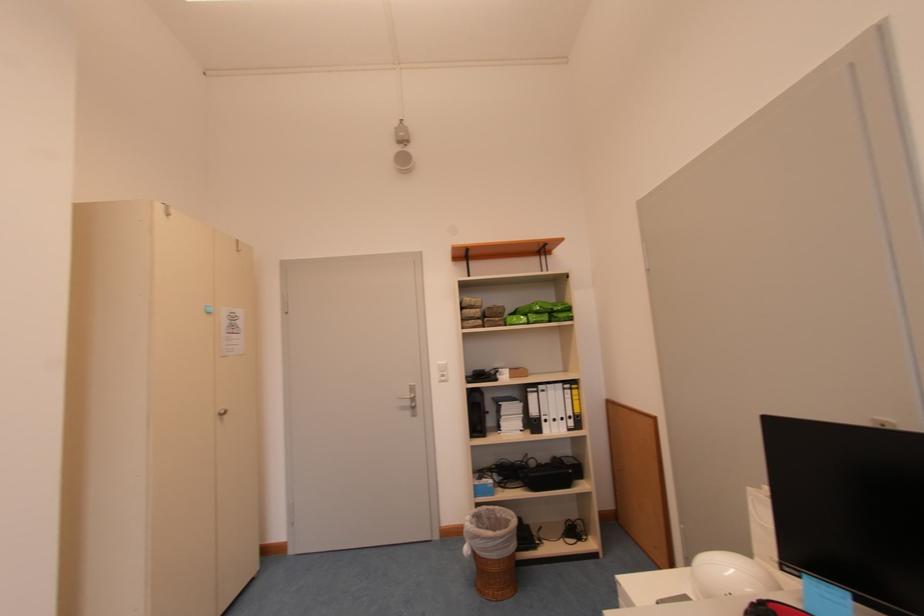
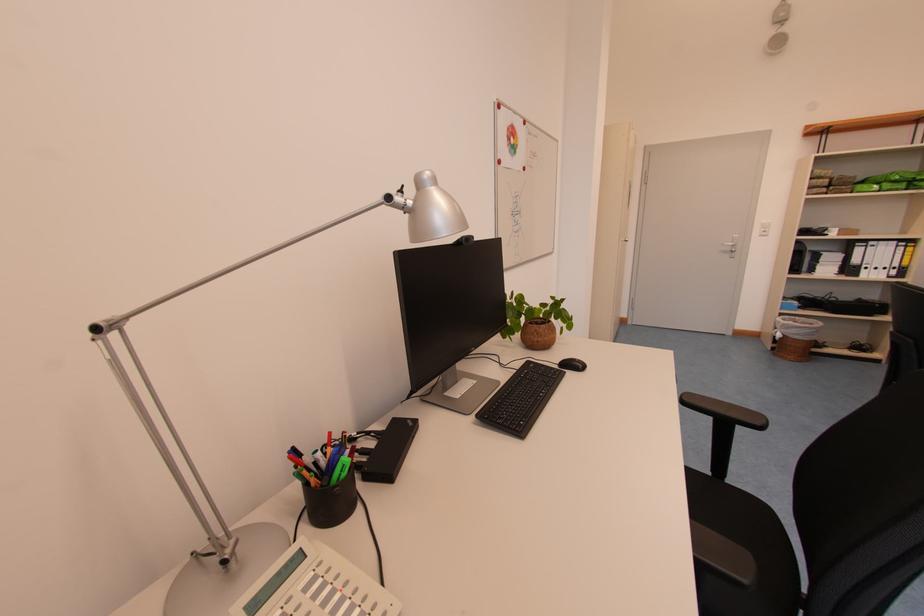
Locate, in the second image, the point that corresponds to point (536, 392) in the first image.

(865, 246)